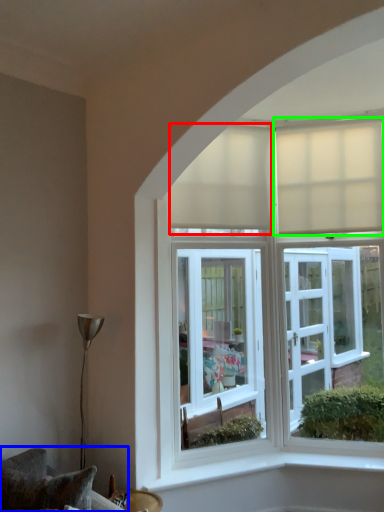
Question: Estimate the real-world distances between objects in this image. Which object is closer to curtain (highlighted by a red box), furniture (highlighted by a blue box) or curtain (highlighted by a green box)?

Choices:
 (A) furniture
 (B) curtain

Answer: (B)